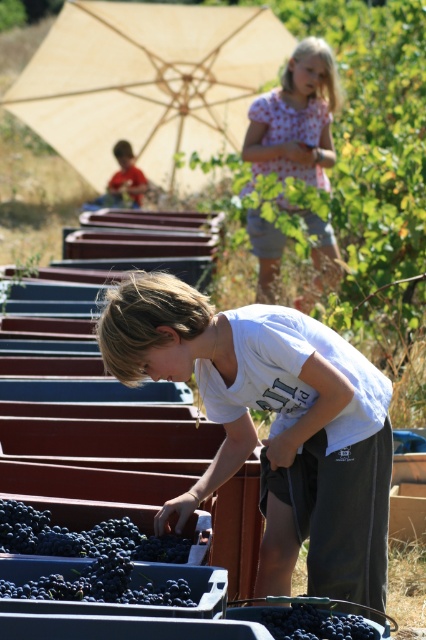
Does light pink polka dot shirt at upper center have a greater width compared to dark purple grapes at lower left?

Correct, the width of light pink polka dot shirt at upper center exceeds that of dark purple grapes at lower left.

Which is below, light pink polka dot shirt at upper center or dark purple grapes at lower left?

dark purple grapes at lower left is below.

This screenshot has width=426, height=640. What are the coordinates of `light pink polka dot shirt at upper center` in the screenshot? It's located at (296, 118).

Does light pink polka dot shirt at upper center have a larger size compared to dark purple grapes at lower center?

Indeed, light pink polka dot shirt at upper center has a larger size compared to dark purple grapes at lower center.

Who is positioned more to the right, light pink polka dot shirt at upper center or dark purple grapes at lower center?

Positioned to the right is light pink polka dot shirt at upper center.

Locate an element on the screen. Image resolution: width=426 pixels, height=640 pixels. light pink polka dot shirt at upper center is located at coordinates (296, 118).

Can you confirm if light pink polka dot shirt at upper center is taller than matte red shirt at upper left?

Yes.

Is light pink polka dot shirt at upper center shorter than matte red shirt at upper left?

No, light pink polka dot shirt at upper center is not shorter than matte red shirt at upper left.

Is point (264, 243) closer to camera compared to point (129, 198)?

Yes, point (264, 243) is closer to viewer.

The height and width of the screenshot is (640, 426). Find the location of `light pink polka dot shirt at upper center`. light pink polka dot shirt at upper center is located at coordinates [x=296, y=118].